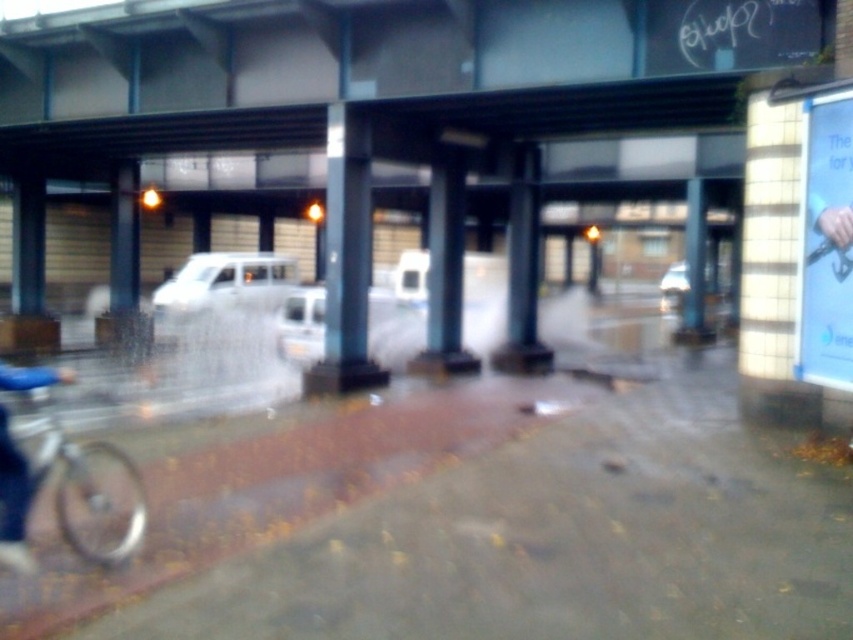
Which is in front, point (103, 483) or point (303, 326)?

Point (103, 483) is in front.

Is point (114, 449) closer to viewer compared to point (308, 342)?

That is True.

The width and height of the screenshot is (853, 640). I want to click on silver metallic bicycle at lower left, so click(84, 486).

Does white matte van at center appear under white glossy van at center?

No.

Does white matte van at center have a lesser height compared to white glossy van at center?

No.

Is point (236, 296) positioned in front of point (300, 296)?

No, it is behind (300, 296).

You are a GUI agent. You are given a task and a screenshot of the screen. Output one action in this format:
    pyautogui.click(x=<x>, y=<y>)
    Task: Click on the white matte van at center
    
    Given the screenshot: What is the action you would take?
    pyautogui.click(x=224, y=284)

Who is taller, silver metallic bicycle at lower left or white matte van at center?

With more height is white matte van at center.

Between silver metallic bicycle at lower left and white matte van at center, which one is positioned lower?

silver metallic bicycle at lower left

Does point (97, 545) come behind point (201, 310)?

No, (97, 545) is closer to viewer.

Where is `silver metallic bicycle at lower left`? The width and height of the screenshot is (853, 640). silver metallic bicycle at lower left is located at coordinates (84, 486).